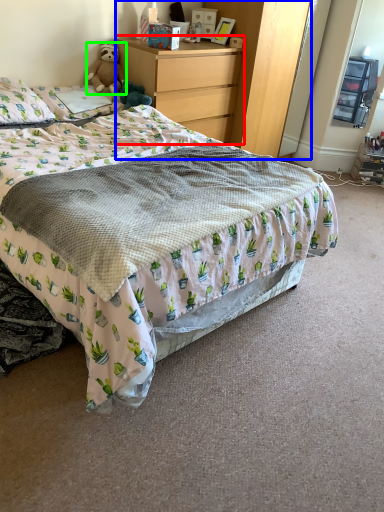
Question: Which is nearer to the chest of drawers (highlighted by a red box)? dresser (highlighted by a blue box) or teddy bear (highlighted by a green box).

Choices:
 (A) dresser
 (B) teddy bear

Answer: (A)